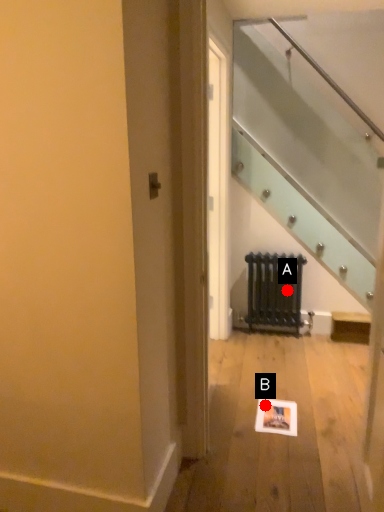
Question: Two points are circled on the image, labeled by A and B beside each circle. Which point appears closest to the camera in this image?

Choices:
 (A) A is closer
 (B) B is closer

Answer: (B)